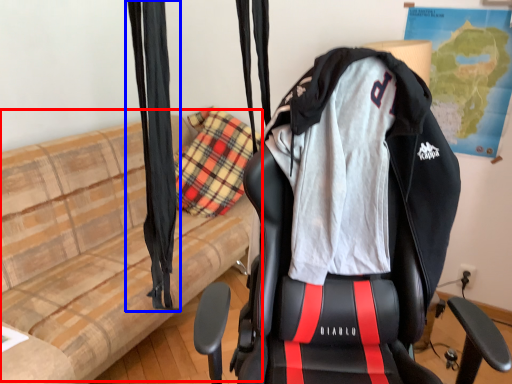
Question: Which of the following is the farthest to the observer, couch (highlighted by a red box) or curtain (highlighted by a blue box)?

Choices:
 (A) couch
 (B) curtain

Answer: (A)